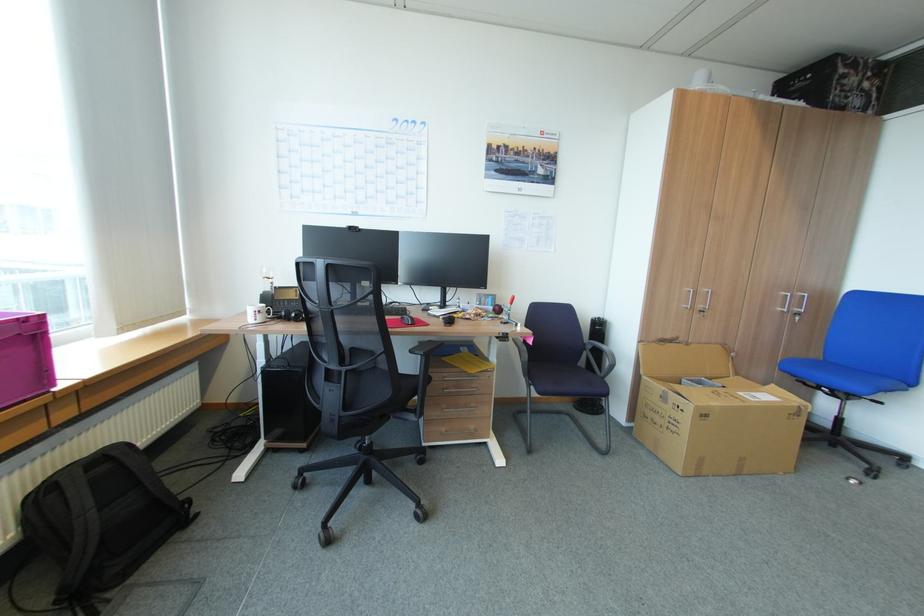
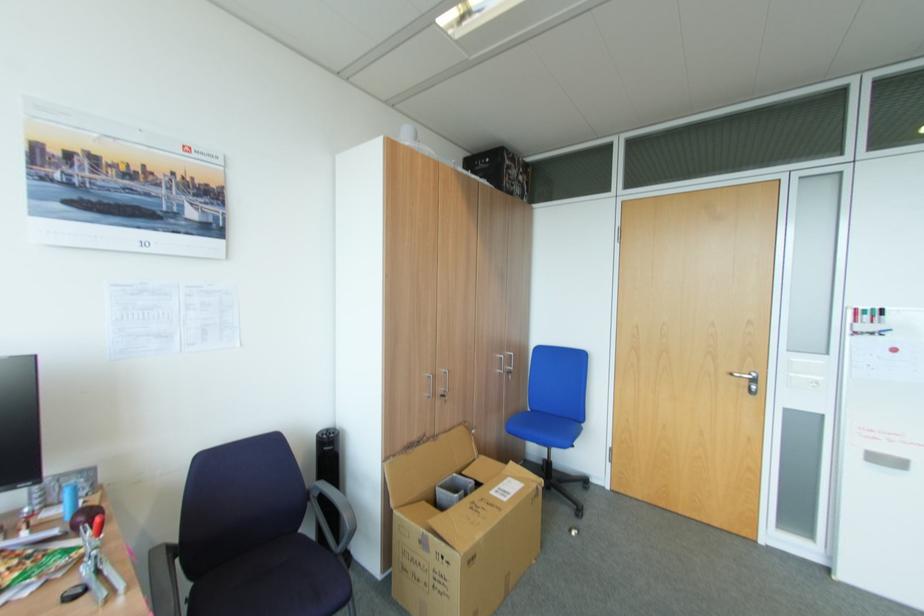
The point at [711,416] is marked in the first image. Where is the corresponding point in the second image?

(479, 556)